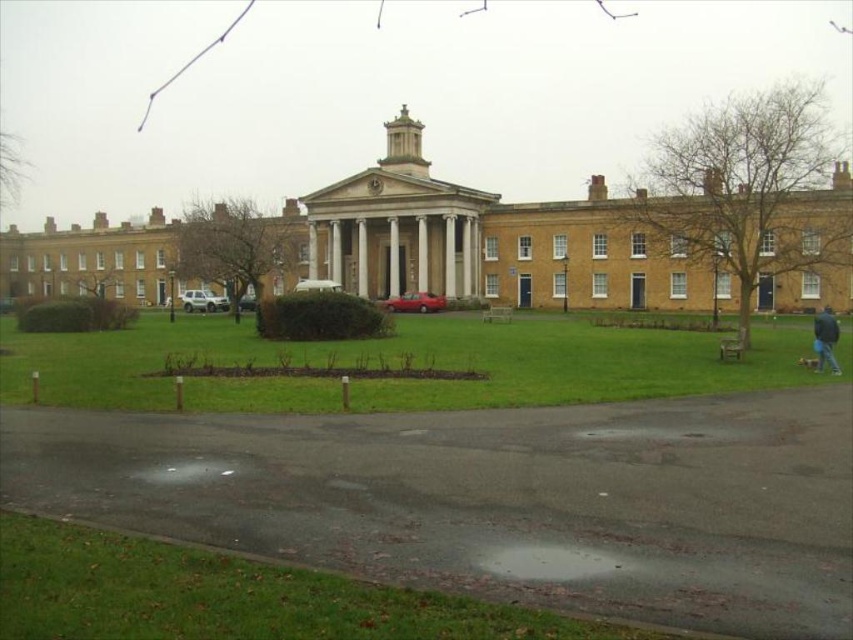
Can you confirm if green grass at lower center is positioned to the right of blue fabric jacket at lower right?

Incorrect, green grass at lower center is not on the right side of blue fabric jacket at lower right.

Who is lower down, green grass at lower center or blue fabric jacket at lower right?

green grass at lower center

Is point (241, 396) positioned before point (828, 310)?

Yes, point (241, 396) is in front of point (828, 310).

Where is `green grass at lower center`? green grass at lower center is located at coordinates (409, 360).

Who is shorter, green grass at lower center or green grass at lower left?

Standing shorter between the two is green grass at lower left.

Can you confirm if green grass at lower center is thinner than green grass at lower left?

No.

Does point (148, 385) lie in front of point (20, 534)?

No, (148, 385) is behind (20, 534).

Identify the location of green grass at lower center. (409, 360).

Is point (39, 584) positioned after point (831, 358)?

That is False.

Measure the distance between green grass at lower left and camera.

A distance of 29.07 feet exists between green grass at lower left and camera.

At what (x,y) coordinates should I click in order to perform the action: click on green grass at lower left. Please return your answer as a coordinate pair (x, y). This screenshot has height=640, width=853. Looking at the image, I should click on (230, 596).